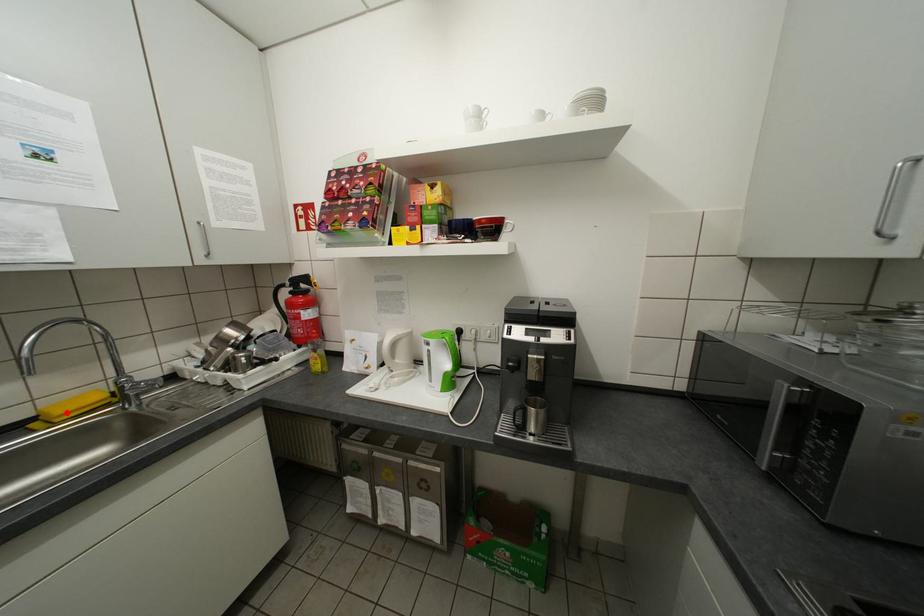
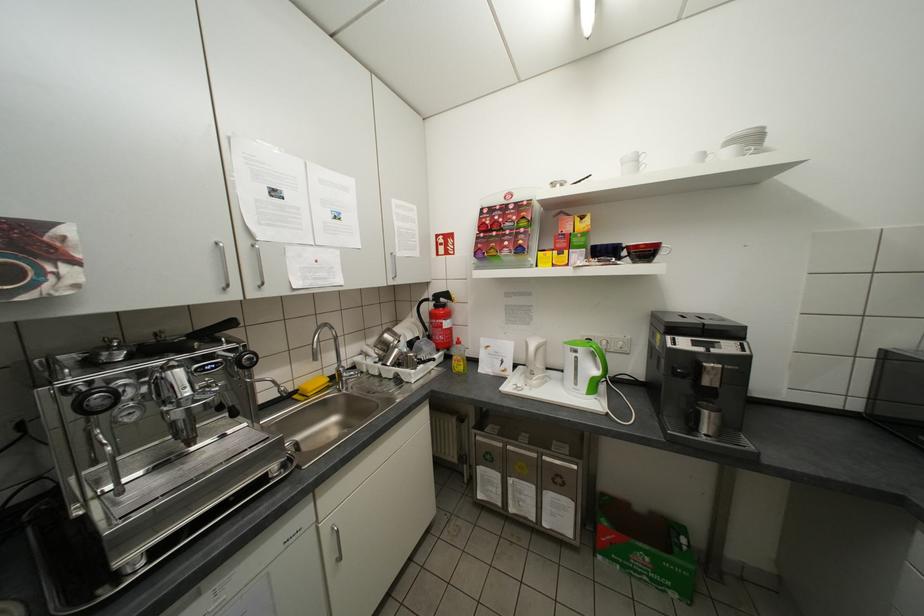
Question: I am providing you with two images of the same scene from different viewpoints. A red point is marked on the first image. Can you still see the location of the red point in image 2?

Choices:
 (A) Yes
 (B) No

Answer: (A)